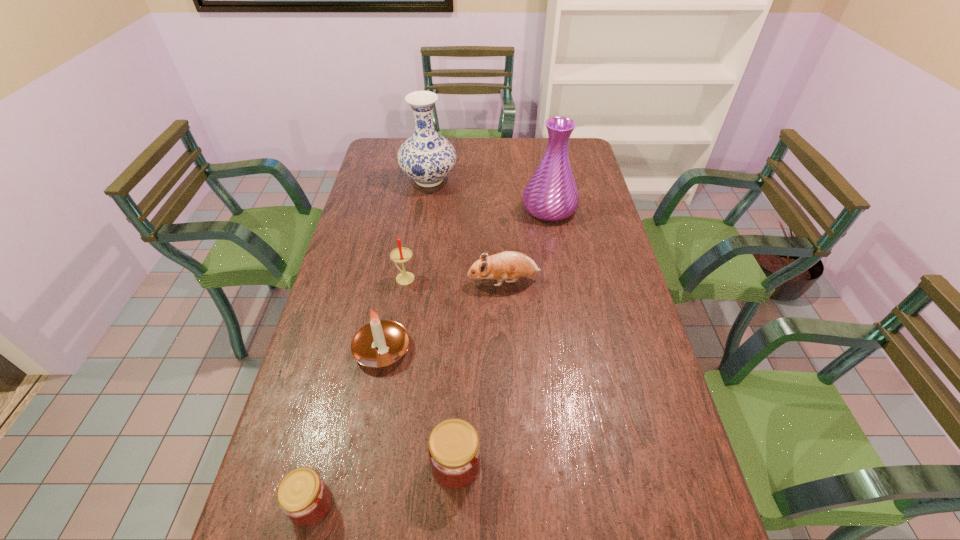
I want to click on the shorter jam, so click(x=303, y=496).

This screenshot has width=960, height=540. I want to click on the shortest object, so click(x=303, y=496).

The width and height of the screenshot is (960, 540). In order to click on the right jam in this screenshot , I will do `click(454, 448)`.

I want to click on the farther candle, so click(399, 255).

Where is `the left vase`? This screenshot has height=540, width=960. the left vase is located at coordinates (426, 157).

Locate an element on the screen. This screenshot has width=960, height=540. the nearer candle is located at coordinates (380, 343).

Image resolution: width=960 pixels, height=540 pixels. In order to click on the right vase in this screenshot , I will do [x=551, y=194].

Where is `hamster`? hamster is located at coordinates (513, 265).

You are a GUI agent. You are given a task and a screenshot of the screen. Output one action in this format:
    pyautogui.click(x=<x>, y=<y>)
    Task: Click on the free spot located on the back of the shorter jam
    
    Given the screenshot: What is the action you would take?
    pyautogui.click(x=330, y=430)

Find the location of a particular element. Image resolution: width=960 pixels, height=540 pixels. vacant space located 0.060m on the front of the right jam is located at coordinates (454, 523).